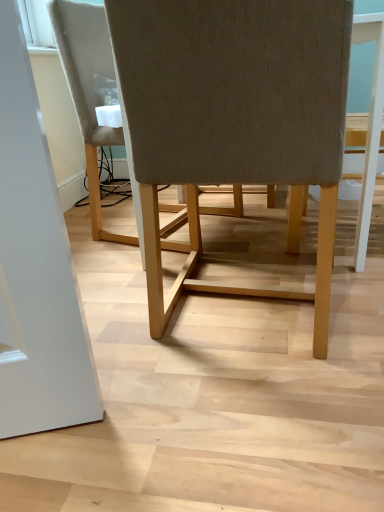
The image size is (384, 512). Describe the element at coordinates (234, 114) in the screenshot. I see `matte beige fabric chair at center` at that location.

The width and height of the screenshot is (384, 512). I want to click on matte beige fabric chair at center, so click(234, 114).

Identify the location of matte beige fabric chair at center. (234, 114).